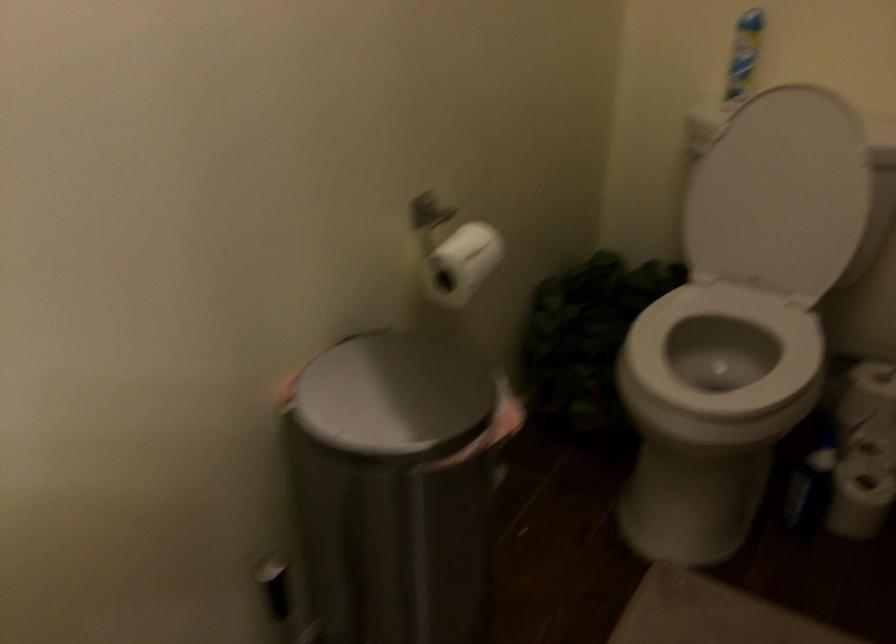
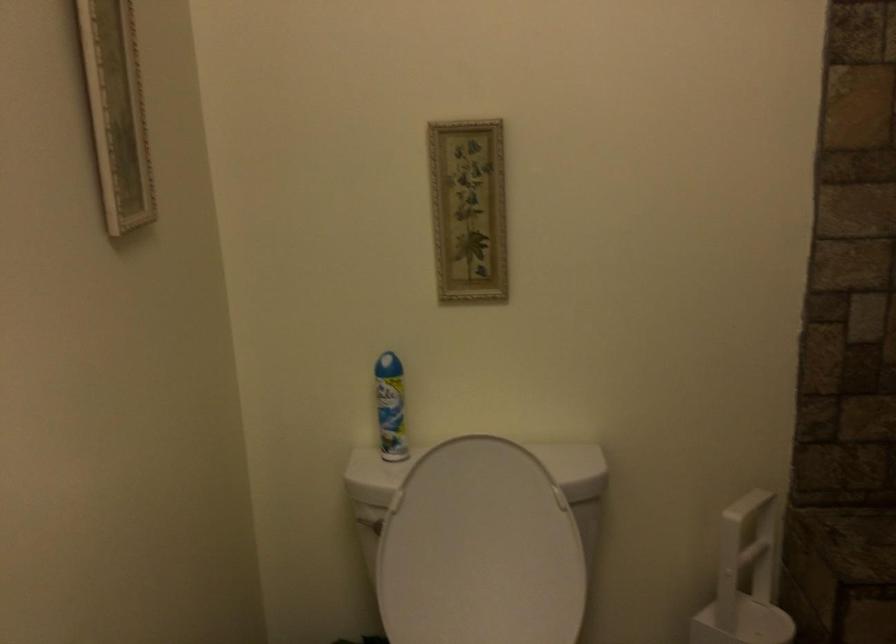
Where in the second image is the point corresponding to pixel 778 187 from the first image?

(479, 550)